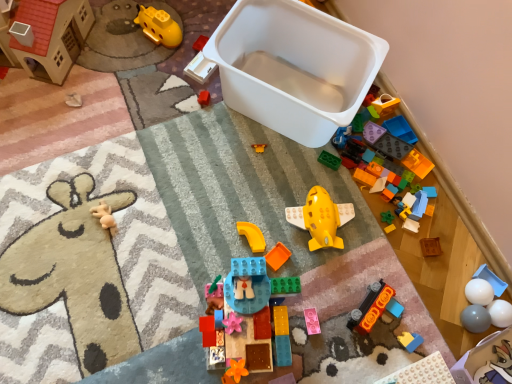
The height and width of the screenshot is (384, 512). I want to click on free space between matte plastic toy at lower right, which is counted as the 12th toy, starting from the left, and orange matte car at lower right, marked as the 9th toy in a left-to-right arrangement, so click(x=390, y=332).